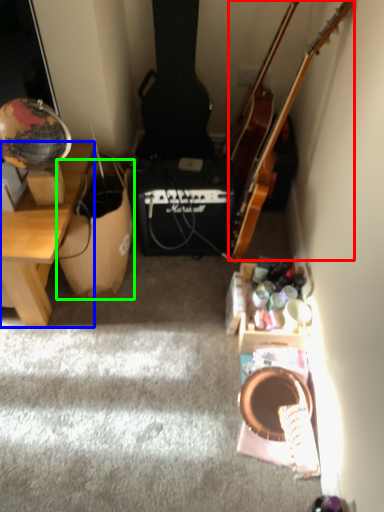
Question: Estimate the real-world distances between objects in this image. Which object is farther from guitar (highlighted by a red box), desk (highlighted by a blue box) or cardboard box (highlighted by a green box)?

Choices:
 (A) desk
 (B) cardboard box

Answer: (A)